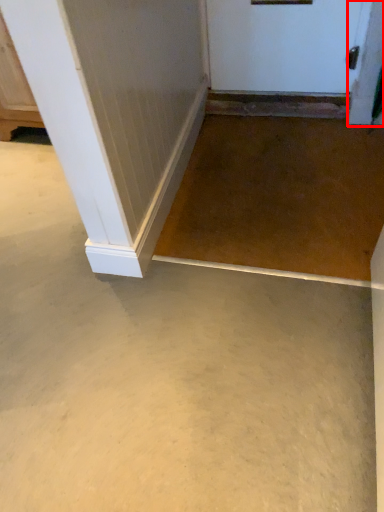
Question: Considering the relative positions of screen door (annotated by the red box) and concrete in the image provided, where is screen door (annotated by the red box) located with respect to the staircase?

Choices:
 (A) right
 (B) left

Answer: (A)